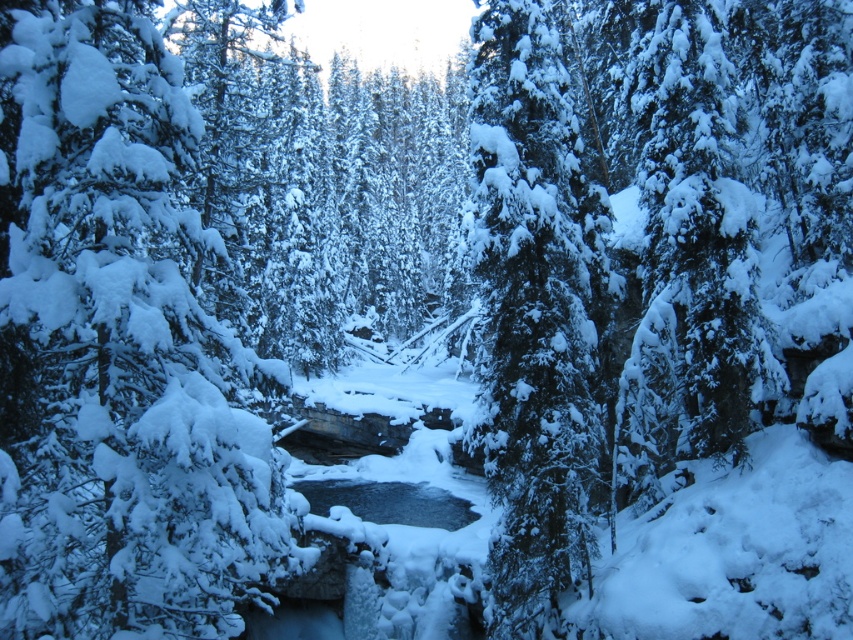
Question: Can you confirm if snow-covered evergreen at left is wider than green textured pine at center?

Choices:
 (A) yes
 (B) no

Answer: (B)

Question: Which of the following is the farthest from the observer?

Choices:
 (A) (583, 214)
 (B) (273, 541)

Answer: (A)

Question: Among these objects, which one is nearest to the camera?

Choices:
 (A) green textured pine at center
 (B) snow-covered evergreen at left

Answer: (B)

Question: From the image, what is the correct spatial relationship of snow-covered evergreen at left in relation to green textured pine at center?

Choices:
 (A) above
 (B) below

Answer: (B)

Question: Is snow-covered evergreen at left wider than green textured pine at center?

Choices:
 (A) no
 (B) yes

Answer: (A)